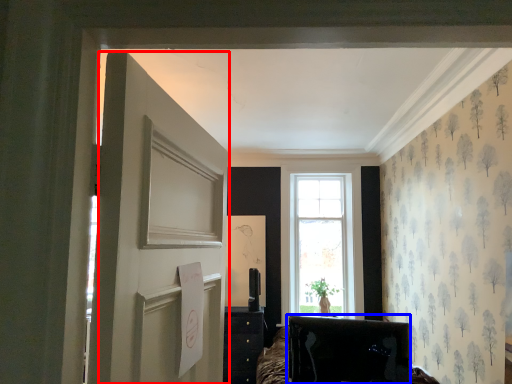
Question: Which object is closer to the camera taking this photo, door (highlighted by a red box) or furniture (highlighted by a blue box)?

Choices:
 (A) door
 (B) furniture

Answer: (A)